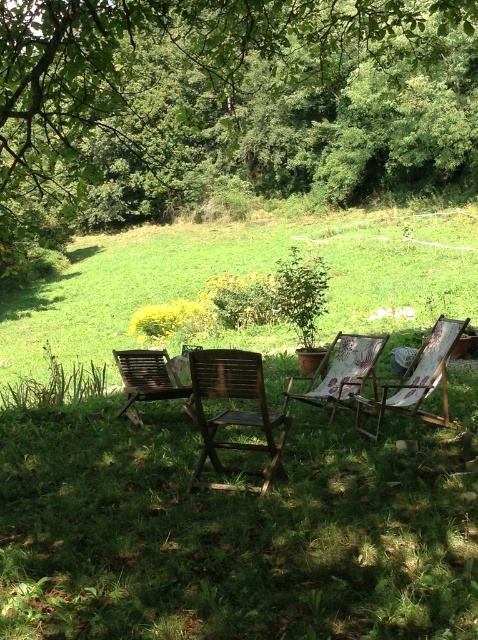
Question: Does green leafy tree at upper center have a lesser width compared to wooden textured chair at center?

Choices:
 (A) yes
 (B) no

Answer: (B)

Question: Considering the real-world distances, which object is farthest from the green leafy tree at upper center?

Choices:
 (A) wooden textured chair at center
 (B) green grassy at lower center

Answer: (A)

Question: In this image, where is green grassy at center located relative to wooden slatted chair at left?

Choices:
 (A) above
 (B) below

Answer: (A)

Question: Which of the following is the closest to the observer?

Choices:
 (A) wooden slatted chair at left
 (B) green leafy tree at upper center
 (C) green grassy at lower center

Answer: (B)

Question: Is wooden chair at center further to camera compared to wooden textured chair at center?

Choices:
 (A) no
 (B) yes

Answer: (A)

Question: Which of the following is the farthest from the observer?

Choices:
 (A) green grassy at center
 (B) wooden deck chair at right
 (C) green leafy tree at upper center
 (D) wooden slatted chair at left

Answer: (D)